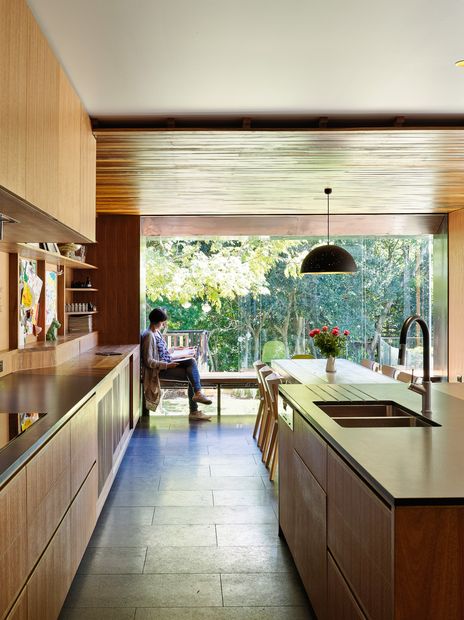
This screenshot has height=620, width=464. What are the coordinates of `ceiling` in the screenshot? It's located at (219, 77).